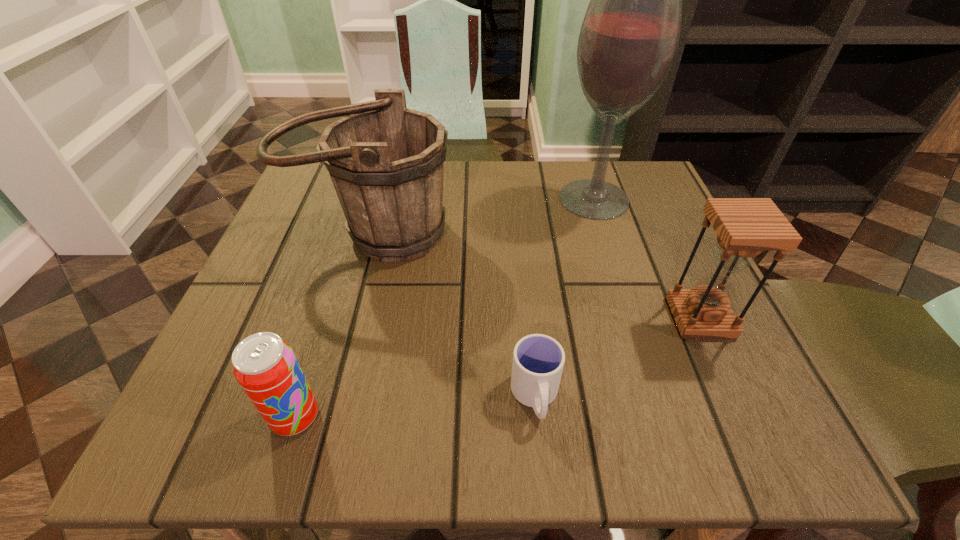
The width and height of the screenshot is (960, 540). I want to click on vacant space in between the alcohol and the bucket, so coord(483,216).

This screenshot has height=540, width=960. Find the location of `vacant area that lies between the hourglass and the soda can`. vacant area that lies between the hourglass and the soda can is located at coordinates (498, 367).

Identify the location of free space between the soda can and the hourglass. (498, 367).

Where is `free space that is in between the fourth tallest object and the alcohol`? This screenshot has height=540, width=960. free space that is in between the fourth tallest object and the alcohol is located at coordinates (444, 308).

The image size is (960, 540). I want to click on vacant space that is in between the hourglass and the cup, so click(x=617, y=357).

Where is `empty space between the tallest object and the soda can`? empty space between the tallest object and the soda can is located at coordinates (444, 308).

Find the location of a particular element. This screenshot has height=540, width=960. vacant space in between the third nearest object and the second shortest object is located at coordinates pos(498,367).

Locate an element on the screen. The image size is (960, 540). vacant point located between the alcohol and the shortest object is located at coordinates (564, 298).

At what (x,y) coordinates should I click in order to perform the action: click on vacant area that lies between the bucket and the tallest object. Please return your answer as a coordinate pair (x, y). Looking at the image, I should click on (483, 216).

Find the location of a particular element. The height and width of the screenshot is (540, 960). object that is the closest one to the soda can is located at coordinates pyautogui.click(x=386, y=162).